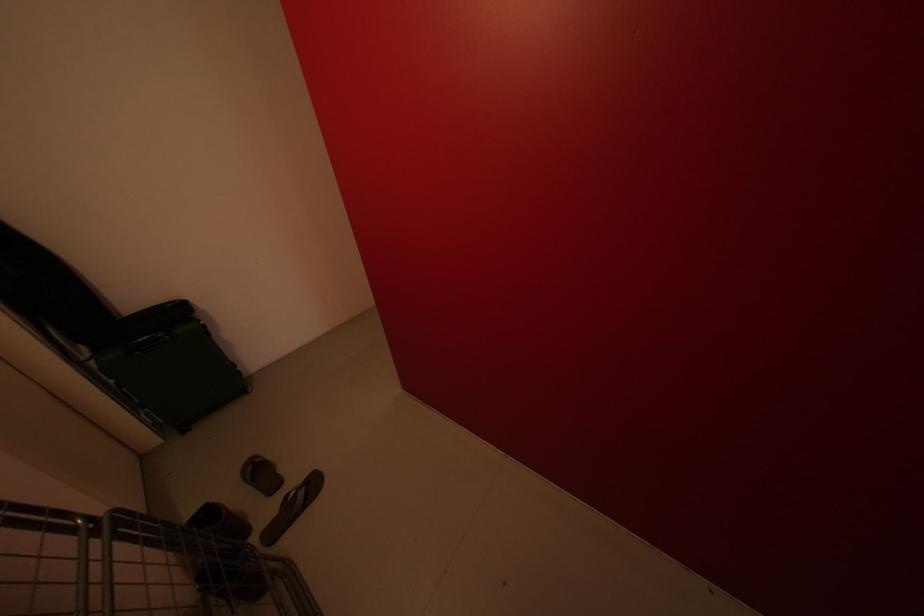
Image resolution: width=924 pixels, height=616 pixels. I want to click on suitcase handle, so [148, 342].